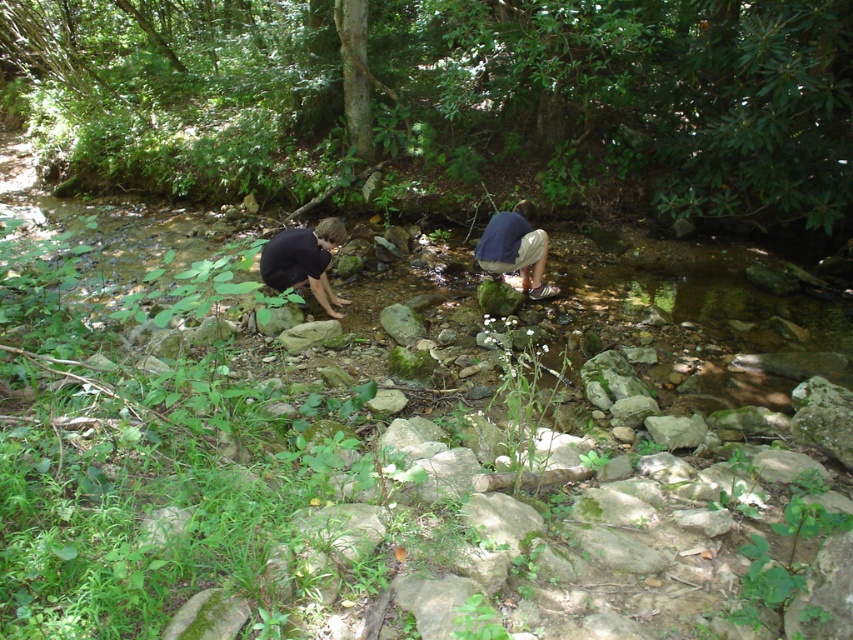
Question: Is green leafy forest at center closer to camera compared to black matte shirt at center?

Choices:
 (A) yes
 (B) no

Answer: (B)

Question: Is the position of green leafy forest at center less distant than that of dark blue fabric at center?

Choices:
 (A) no
 (B) yes

Answer: (B)

Question: Can you confirm if green leafy forest at center is positioned above black matte shirt at center?

Choices:
 (A) no
 (B) yes

Answer: (B)

Question: Which of these objects is positioned farthest from the black matte shirt at center?

Choices:
 (A) green leafy forest at center
 (B) dark blue fabric at center

Answer: (A)

Question: Which point is closer to the camera taking this photo?

Choices:
 (A) (515, 244)
 (B) (247, 60)

Answer: (A)

Question: Which object is closer to the camera taking this photo?

Choices:
 (A) dark blue fabric at center
 (B) green leafy forest at center
 (C) black matte shirt at center

Answer: (C)